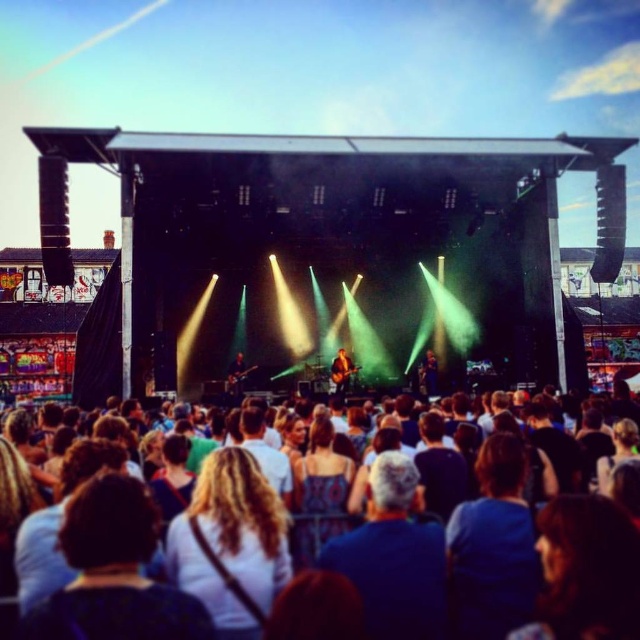
Question: Is shiny brown guitar at center thinner than glossy black guitar at center?

Choices:
 (A) no
 (B) yes

Answer: (A)

Question: Among these objects, which one is farthest from the camera?

Choices:
 (A) glossy black guitar at center
 (B) brown fabric crowd at lower center
 (C) shiny brown guitar at center
 (D) dark brown leather jacket at center

Answer: (D)

Question: Is dark brown leather jacket at center bigger than glossy black guitar at center?

Choices:
 (A) no
 (B) yes

Answer: (A)

Question: Which of these objects is positioned farthest from the shiny brown guitar at center?

Choices:
 (A) brown fabric crowd at lower center
 (B) dark brown leather jacket at center

Answer: (A)

Question: Can you confirm if brown fabric crowd at lower center is positioned to the right of shiny brown guitar at center?

Choices:
 (A) yes
 (B) no

Answer: (B)

Question: Which is farther from the dark brown leather jacket at center?

Choices:
 (A) glossy black guitar at center
 (B) shiny brown guitar at center

Answer: (A)